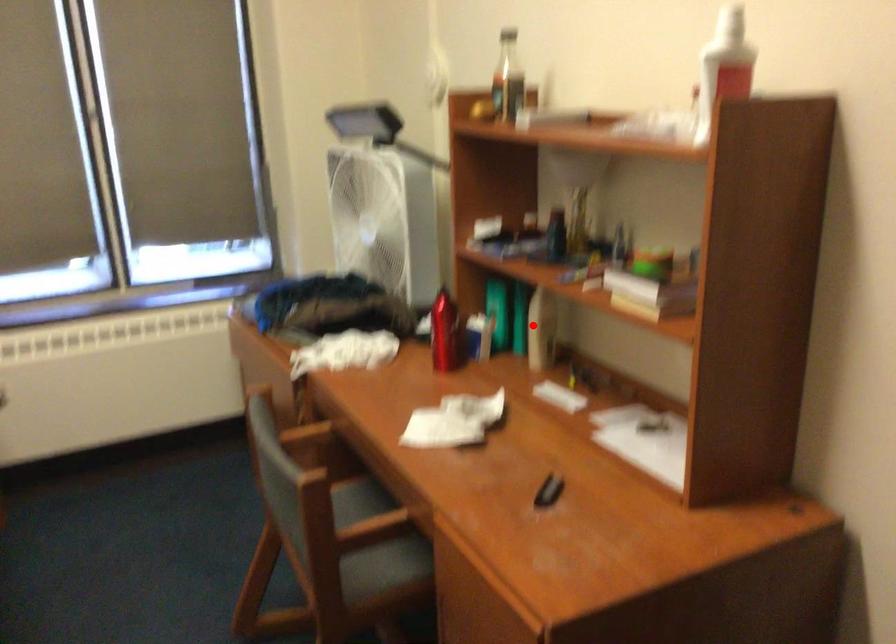
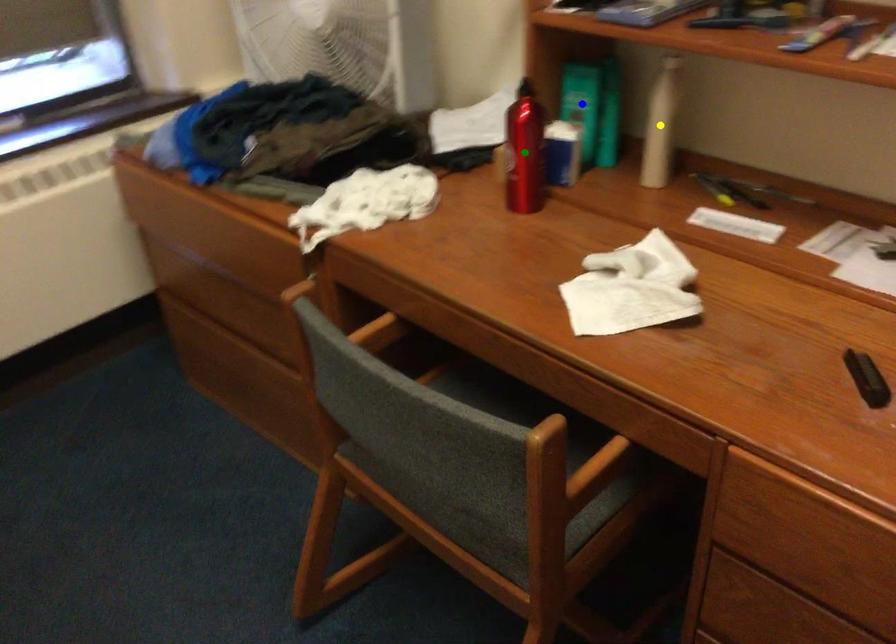
Question: I am providing you with two images of the same scene from different viewpoints. A red point is marked on the first image. You are given multiple points on the second image. Which point in image 2 is actually the same real-world point as the red point in image 1?

Choices:
 (A) blue point
 (B) green point
 (C) yellow point

Answer: (C)